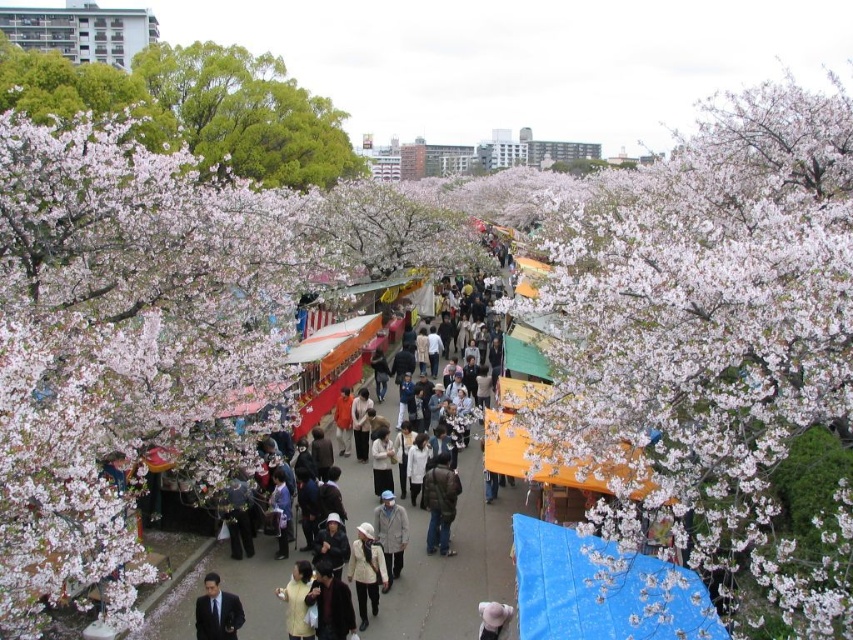
Question: Which of the following is the farthest from the observer?

Choices:
 (A) fluffy white blossoms at left
 (B) white textured coat at center
 (C) dark brown jacket at center
 (D) light gray fabric jacket at center

Answer: (C)

Question: Which point is closer to the camera?

Choices:
 (A) (306, 608)
 (B) (378, 545)
 (C) (445, 452)
 (D) (6, 134)

Answer: (A)

Question: Is fluffy white blossoms at left further to the viewer compared to green leafy tree at upper left?

Choices:
 (A) yes
 (B) no

Answer: (B)

Question: Which point is closer to the camera?

Choices:
 (A) light gray fabric jacket at center
 (B) dark suit at lower left
 (C) green leafy tree at upper left
 (D) white textured coat at center

Answer: (B)

Question: Can you confirm if green leafy tree at upper left is positioned below dark brown jacket at center?

Choices:
 (A) yes
 (B) no

Answer: (B)

Question: Is green leafy tree at upper left bigger than dark suit at lower left?

Choices:
 (A) no
 (B) yes

Answer: (B)